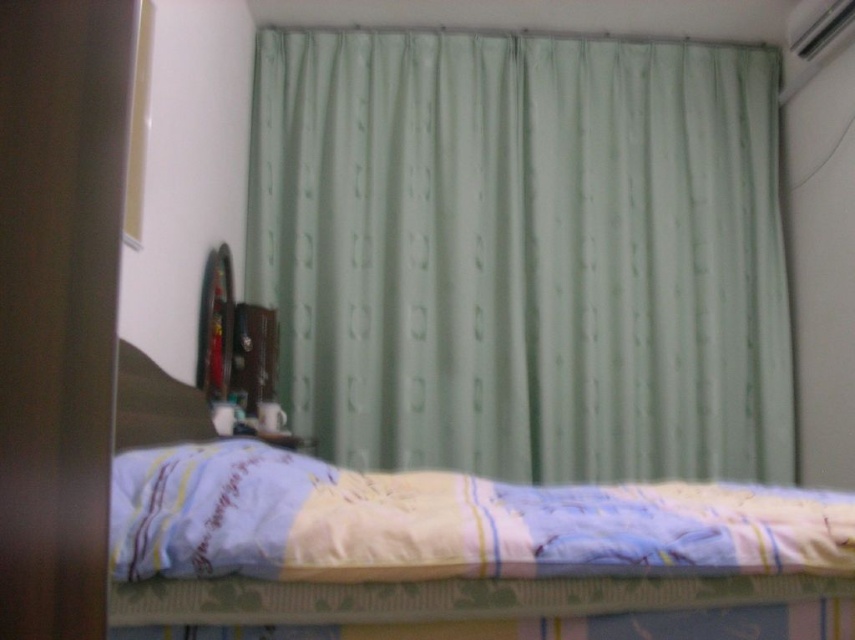
Does yellow fabric bed at lower center appear on the right side of light blue quilted blanket at lower center?

No, yellow fabric bed at lower center is not to the right of light blue quilted blanket at lower center.

Is yellow fabric bed at lower center smaller than light blue quilted blanket at lower center?

Yes, yellow fabric bed at lower center is smaller than light blue quilted blanket at lower center.

Who is more distant from viewer, (594, 600) or (679, 515)?

The point (679, 515) is behind.

I want to click on yellow fabric bed at lower center, so click(x=453, y=547).

Who is more distant from viewer, (378, 413) or (428, 502)?

The point (378, 413) is behind.

The height and width of the screenshot is (640, 855). Describe the element at coordinates (523, 253) in the screenshot. I see `light green fabric curtain at upper center` at that location.

At what (x,y) coordinates should I click in order to perform the action: click on light green fabric curtain at upper center. Please return your answer as a coordinate pair (x, y). The height and width of the screenshot is (640, 855). Looking at the image, I should click on (523, 253).

Does yellow fabric bed at lower center have a greater width compared to brown fabric pillow at lower left?

Yes.

Between yellow fabric bed at lower center and brown fabric pillow at lower left, which one is positioned higher?

brown fabric pillow at lower left is above.

Which is in front, point (782, 557) or point (156, 376)?

Point (782, 557) is in front.

This screenshot has height=640, width=855. What are the coordinates of `yellow fabric bed at lower center` in the screenshot? It's located at (453, 547).